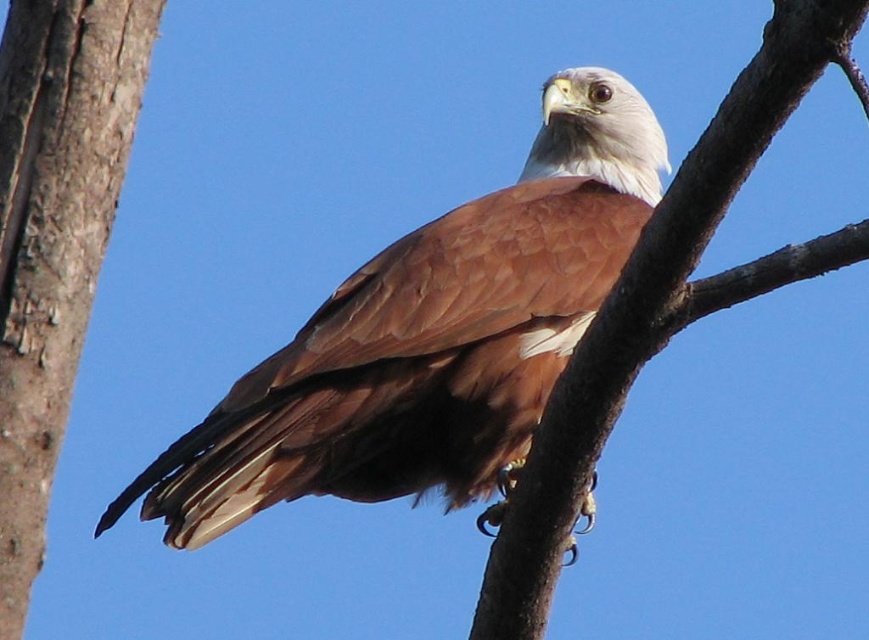
Question: Which of the following is the farthest from the observer?

Choices:
 (A) rough bark tree trunk at left
 (B) brown feathered eagle at center
 (C) brown textured branch at center

Answer: (A)

Question: Is rough bark tree trunk at left to the right of brown textured branch at center from the viewer's perspective?

Choices:
 (A) yes
 (B) no

Answer: (B)

Question: Can you confirm if brown feathered eagle at center is positioned above brown textured branch at center?

Choices:
 (A) no
 (B) yes

Answer: (B)

Question: Estimate the real-world distances between objects in this image. Which object is closer to the rough bark tree trunk at left?

Choices:
 (A) brown textured branch at center
 (B) brown feathered eagle at center

Answer: (B)

Question: Is brown feathered eagle at center positioned at the back of brown textured branch at center?

Choices:
 (A) no
 (B) yes

Answer: (B)

Question: Which object is farther from the camera taking this photo?

Choices:
 (A) rough bark tree trunk at left
 (B) brown feathered eagle at center

Answer: (A)